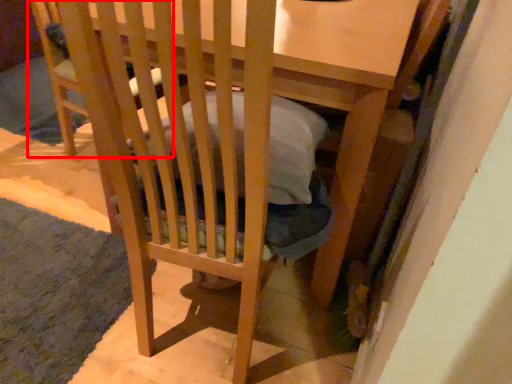
Question: From the image's perspective, considering the relative positions of folding chair (annotated by the red box) and mat in the image provided, where is folding chair (annotated by the red box) located with respect to the staircase?

Choices:
 (A) below
 (B) above

Answer: (B)